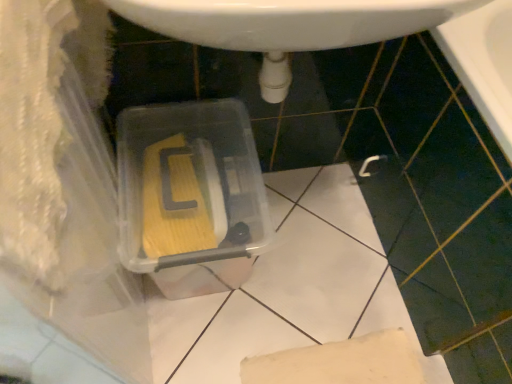
This screenshot has height=384, width=512. I want to click on vacant area located to the right-hand side of transparent plastic storage box at center, so click(315, 238).